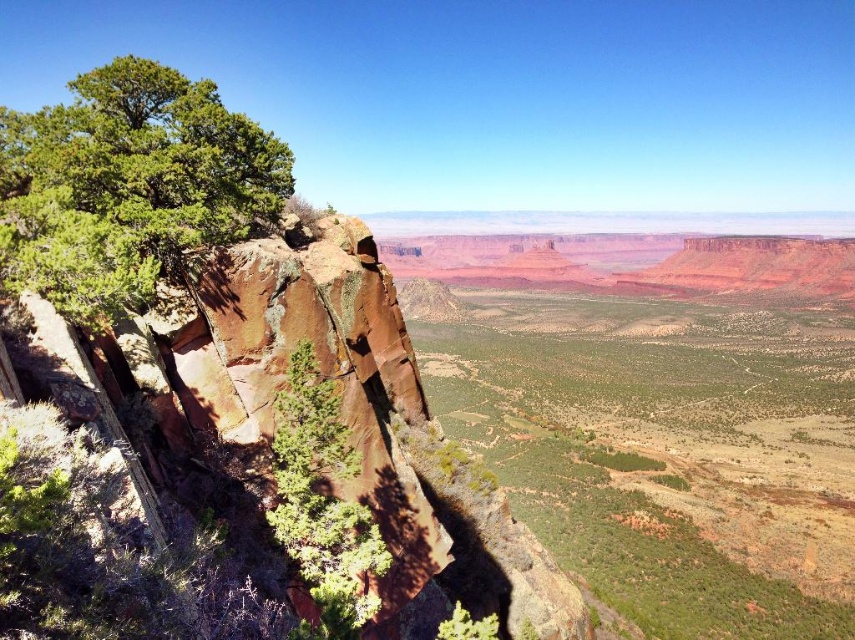
Question: Which point is farther to the camera?

Choices:
 (A) green matte tree at center-left
 (B) green rough bark tree at left

Answer: (B)

Question: Is green rough bark tree at left bigger than green matte tree at center-left?

Choices:
 (A) no
 (B) yes

Answer: (B)

Question: Considering the relative positions of green rough bark tree at left and green matte tree at center-left in the image provided, where is green rough bark tree at left located with respect to green matte tree at center-left?

Choices:
 (A) below
 (B) above

Answer: (B)

Question: Which of the following is the farthest from the observer?

Choices:
 (A) green matte tree at center-left
 (B) green rough bark tree at left

Answer: (B)

Question: Among these points, which one is farthest from the camera?

Choices:
 (A) (68, 285)
 (B) (331, 582)

Answer: (B)

Question: Does green rough bark tree at left have a lesser width compared to green matte tree at center-left?

Choices:
 (A) no
 (B) yes

Answer: (A)